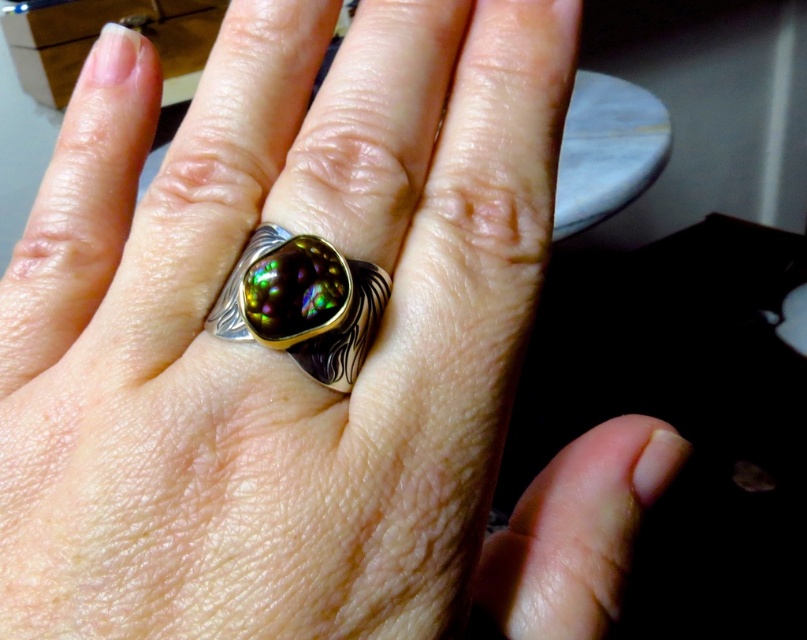
You are a jeweler examining a ring on a hand. You notice two points marked on the ring. The first point is at coordinates point (187, 257) and the second is at point (362, 307). From the perspective of someone looking at the ring from the front, which point is closer to the viewer?

Point (362, 307) is closer to the viewer because the description states that point (187, 257) is behind point (362, 307).